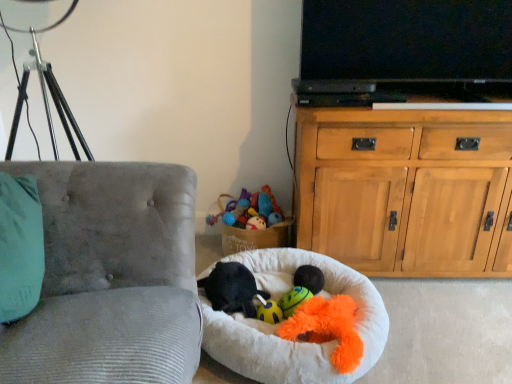
Question: From the image's perspective, is fluffy orange plush toy at center, which is counted as the second toy, starting from the back, above black plush toy at center, placed as the 2th animal when sorted from left to right?

Choices:
 (A) yes
 (B) no

Answer: (B)

Question: Is fluffy orange plush toy at center, which is the first toy in front-to-back order, turned away from black plush toy at center, placed as the 2th animal when sorted from left to right?

Choices:
 (A) yes
 (B) no

Answer: (B)

Question: Considering the relative sizes of fluffy orange plush toy at center, which is the first toy in front-to-back order, and black plush toy at center, placed as the 2th animal when sorted from left to right, in the image provided, is fluffy orange plush toy at center, which is the first toy in front-to-back order, smaller than black plush toy at center, placed as the 2th animal when sorted from left to right,?

Choices:
 (A) yes
 (B) no

Answer: (B)

Question: From the image's perspective, is fluffy orange plush toy at center, which is counted as the second toy, starting from the back, below black plush toy at center, which is counted as the 1th animal, starting from the right?

Choices:
 (A) yes
 (B) no

Answer: (A)

Question: From a real-world perspective, does fluffy orange plush toy at center, which is the first toy in front-to-back order, stand above black plush toy at center, placed as the 2th animal when sorted from left to right?

Choices:
 (A) no
 (B) yes

Answer: (B)

Question: Considering the positions of point (51, 172) and point (300, 268), is point (51, 172) closer or farther from the camera than point (300, 268)?

Choices:
 (A) farther
 (B) closer

Answer: (B)

Question: Looking at their shapes, would you say velvet gray chair at left is wider or thinner than black plush toy at center, placed as the 2th animal when sorted from left to right?

Choices:
 (A) wide
 (B) thin

Answer: (A)

Question: Which is correct: velvet gray chair at left is inside black plush toy at center, which is counted as the 1th animal, starting from the right, or outside of it?

Choices:
 (A) inside
 (B) outside

Answer: (B)

Question: From a real-world perspective, is velvet gray chair at left positioned above or below black plush toy at center, which is counted as the 1th animal, starting from the right?

Choices:
 (A) above
 (B) below

Answer: (A)

Question: Is velvet gray chair at left inside or outside of wooden cabinet at right?

Choices:
 (A) outside
 (B) inside

Answer: (A)

Question: Considering the positions of velvet gray chair at left and wooden cabinet at right in the image, is velvet gray chair at left taller or shorter than wooden cabinet at right?

Choices:
 (A) short
 (B) tall

Answer: (B)

Question: Would you say velvet gray chair at left is to the left or to the right of wooden cabinet at right in the picture?

Choices:
 (A) right
 (B) left

Answer: (B)

Question: In terms of width, does velvet gray chair at left look wider or thinner when compared to wooden cabinet at right?

Choices:
 (A) wide
 (B) thin

Answer: (A)

Question: Based on their sizes in the image, would you say wooden cabinet at right is bigger or smaller than velvet gray chair at left?

Choices:
 (A) small
 (B) big

Answer: (A)

Question: From the image's perspective, is wooden cabinet at right located above or below velvet gray chair at left?

Choices:
 (A) above
 (B) below

Answer: (B)